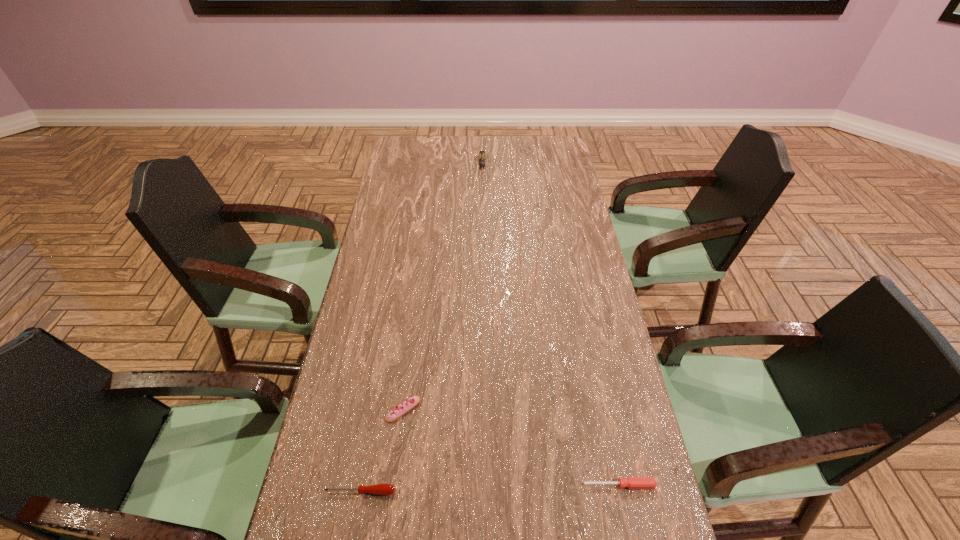
The width and height of the screenshot is (960, 540). Find the location of `eclair at the left edge`. eclair at the left edge is located at coordinates 401,409.

The width and height of the screenshot is (960, 540). Find the location of `screwdriver that is positioned at the left edge`. screwdriver that is positioned at the left edge is located at coordinates (383, 489).

Identify the location of object that is at the right edge. Image resolution: width=960 pixels, height=540 pixels. (631, 482).

Find the location of a particular element. The height and width of the screenshot is (540, 960). vacant space at the far edge is located at coordinates click(x=498, y=140).

Locate an element on the screen. This screenshot has height=540, width=960. vacant space at the left edge of the desktop is located at coordinates click(x=392, y=380).

You are a GUI agent. You are given a task and a screenshot of the screen. Output one action in this format:
    pyautogui.click(x=<x>, y=<y>)
    Task: Click on the vacant space at the right edge of the desktop
    The height and width of the screenshot is (540, 960).
    Given the screenshot: What is the action you would take?
    pyautogui.click(x=590, y=409)

This screenshot has width=960, height=540. I want to click on vacant region at the far left corner of the desktop, so click(x=416, y=143).

At what (x,y) coordinates should I click in order to perform the action: click on vacant space that is in between the farthest screwdriver and the third nearest object. Please return your answer as a coordinate pair (x, y). This screenshot has height=540, width=960. Looking at the image, I should click on (443, 288).

Image resolution: width=960 pixels, height=540 pixels. I want to click on empty location between the rightmost screwdriver and the farthest screwdriver, so click(x=551, y=326).

Where is `free space that is in between the second farthest object and the leftmost screwdriver`? The width and height of the screenshot is (960, 540). free space that is in between the second farthest object and the leftmost screwdriver is located at coordinates (382, 450).